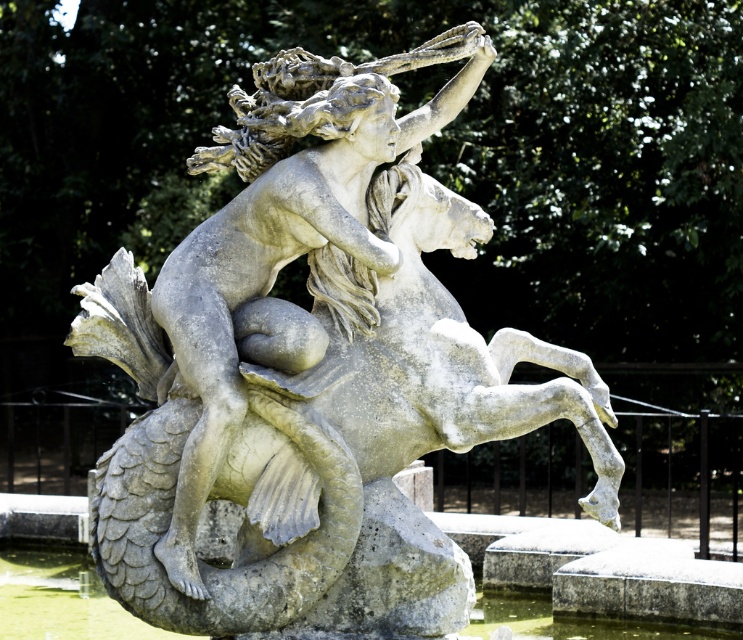
You are an art conservator examining the classical sculpture. You notice the gray stone sculpture at center and the greenish stone water at lower center. Which object is positioned closer to the front of the scene?

The gray stone sculpture at center is positioned closer to the front of the scene than the greenish stone water at lower center, as the water is described as being behind the sculpture.

Based on the scene description, if you were standing in front of the gray stone sculpture at center and wanted to look at the greenish stone water at lower center, which direction should you turn your head?

You should turn your head to the left because the gray stone sculpture at center is to the right of the greenish stone water at lower center.

Based on the scene description, if you were to place a small decorative item between the gray stone sculpture at center and the greenish stone water at lower center, which area would have enough space to accommodate it?

The greenish stone water at lower center has more space available since it occupies a larger area than the gray stone sculpture at center according to the description.